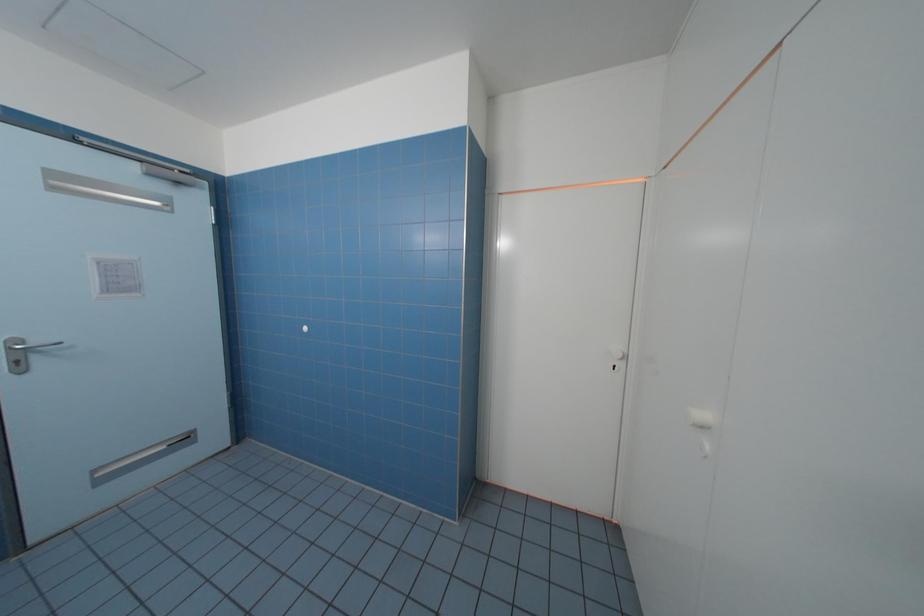
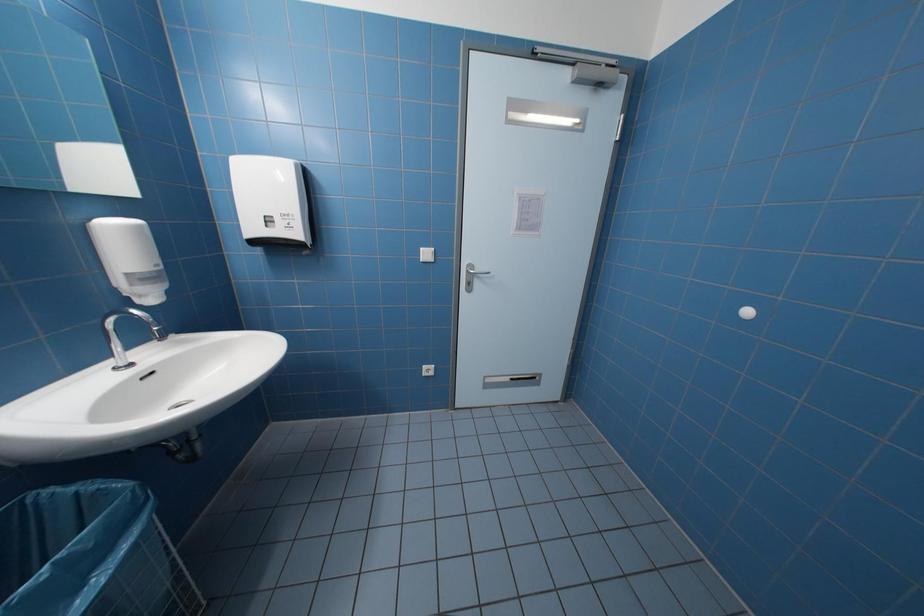
Question: Based on the continuous images, in which direction is the camera rotating? Reply with the corresponding letter.

Choices:
 (A) Left
 (B) Right
 (C) Up
 (D) Down

Answer: (A)